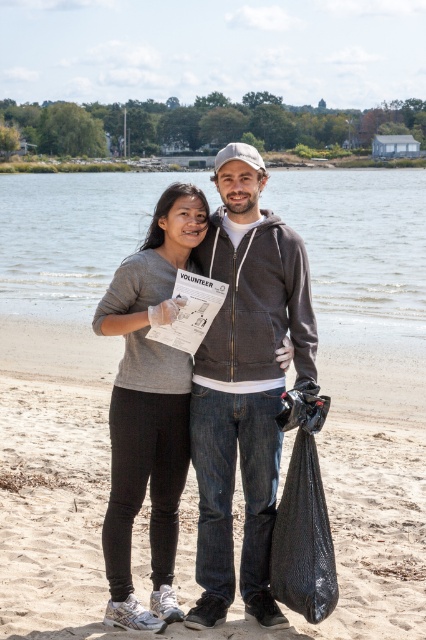
Question: Estimate the real-world distances between objects in this image. Which object is closer to the clear water at center?

Choices:
 (A) sandy beach at center
 (B) dark gray hoodie at center
 (C) black plastic bag at lower right

Answer: (C)

Question: Is sandy beach at center thinner than dark gray hoodie at center?

Choices:
 (A) yes
 (B) no

Answer: (A)

Question: Which point is closer to the camera?

Choices:
 (A) dark gray hoodie at center
 (B) clear water at center

Answer: (A)

Question: Which point appears closest to the camera in this image?

Choices:
 (A) (302, 536)
 (B) (108, 440)
 (C) (244, 381)

Answer: (A)

Question: Considering the relative positions of dark gray hoodie at center and matte gray sweatshirt at center in the image provided, where is dark gray hoodie at center located with respect to matte gray sweatshirt at center?

Choices:
 (A) below
 (B) above

Answer: (B)

Question: Does sandy beach at center lie behind clear water at center?

Choices:
 (A) yes
 (B) no

Answer: (B)